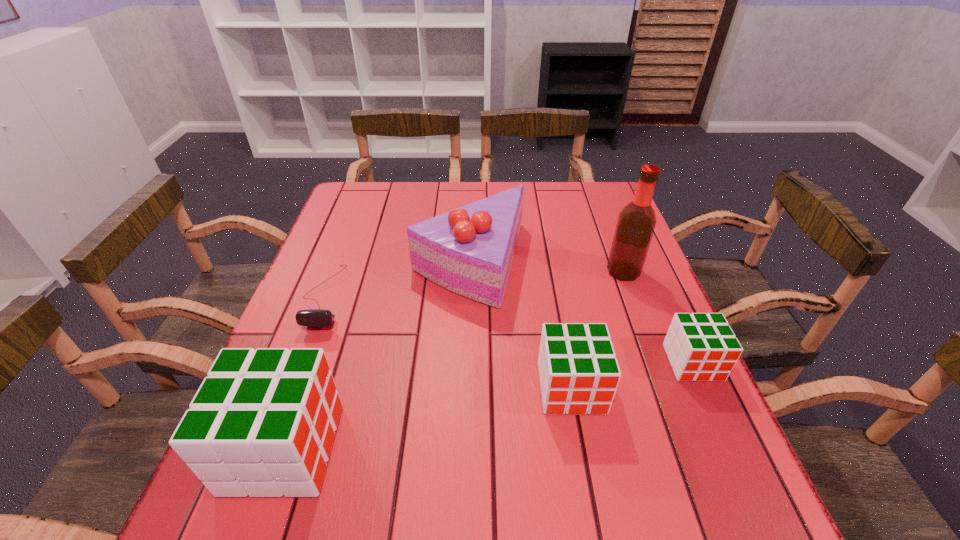
Identify the location of empty space between the leftmost cube and the cake. The width and height of the screenshot is (960, 540). (376, 355).

Select which object is the fourth closest to the cake. Please provide its 2D coordinates. Your answer should be formatted as a tuple, i.e. [(x, y)], where the tuple contains the x and y coordinates of a point satisfying the conditions above.

[(263, 422)]

Identify which object is located as the fourth nearest to the leftmost cube. Please provide its 2D coordinates. Your answer should be formatted as a tuple, i.e. [(x, y)], where the tuple contains the x and y coordinates of a point satisfying the conditions above.

[(702, 347)]

Select which cube appears as the second closest to the tallest cube. Please provide its 2D coordinates. Your answer should be formatted as a tuple, i.e. [(x, y)], where the tuple contains the x and y coordinates of a point satisfying the conditions above.

[(702, 347)]

Locate which cube is the second closest to the tallest object. Please provide its 2D coordinates. Your answer should be formatted as a tuple, i.e. [(x, y)], where the tuple contains the x and y coordinates of a point satisfying the conditions above.

[(579, 373)]

Find the location of a particular element. The width and height of the screenshot is (960, 540). blank space that satisfies the following two spatial constraints: 1. on the front side of the cake; 2. on the left side of the beer bottle is located at coordinates (469, 272).

The width and height of the screenshot is (960, 540). I want to click on vacant position in the image that satisfies the following two spatial constraints: 1. on the red face of the fourth tallest object; 2. on the red face of the tallest cube, so click(583, 448).

The height and width of the screenshot is (540, 960). Find the location of `vacant position in the image that satisfies the following two spatial constraints: 1. on the front side of the tallest object; 2. on the right side of the cake`. vacant position in the image that satisfies the following two spatial constraints: 1. on the front side of the tallest object; 2. on the right side of the cake is located at coordinates (469, 272).